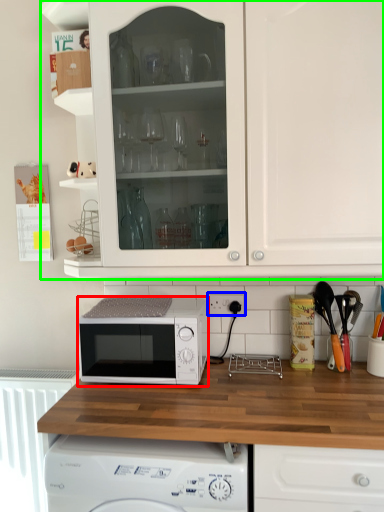
Question: Based on their relative distances, which object is farther from microwave oven (highlighted by a red box)? Choose from electric outlet (highlighted by a blue box) and cabinetry (highlighted by a green box).

Choices:
 (A) electric outlet
 (B) cabinetry

Answer: (B)